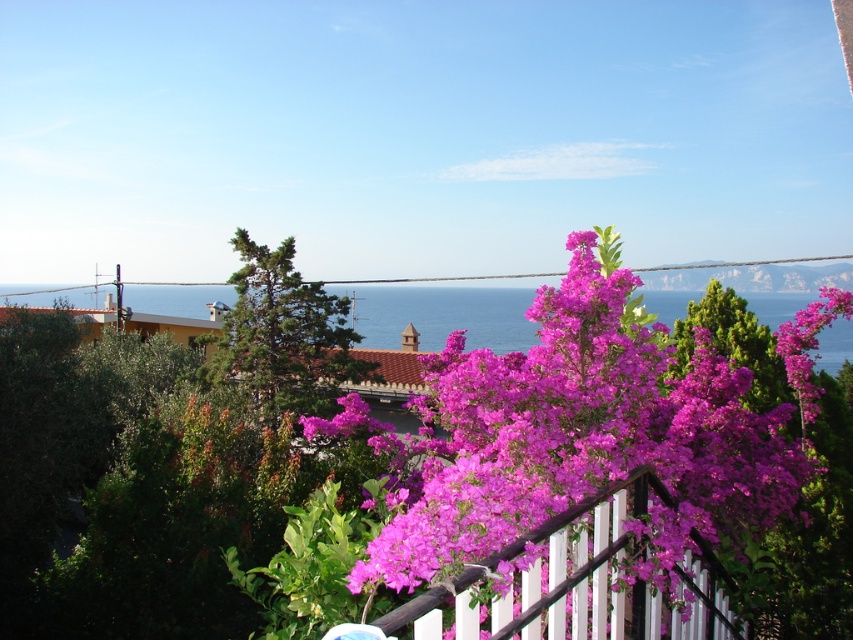
You are standing on a balcony and see the purple matte flowers at center and the wooden fence at center. Which object is located to the left of the other?

The purple matte flowers at center is positioned on the left side of wooden fence at center.

You are an interior designer planning to place a 1.2 meter wide decorative panel between the purple matte flowers at center and the wooden fence at center. Based on the scene, will the panel fit between them?

The purple matte flowers at center are wider than the wooden fence at center. However, the description does not provide the exact distance between them, so it is unclear if the 1.2 meter panel will fit. More information about the spacing between the two objects is needed to determine this.

You are standing on the balcony and want to take a photo of the yellow building with terracotta roof. You notice two points marked in the scene. The first point is at coordinate point (x=608, y=378) and the second is at point (x=527, y=576). Which point is closer to you when you are facing the scene?

Point (x=608, y=378) is closer to you than point (x=527, y=576) because it is further to the viewer according to the description.